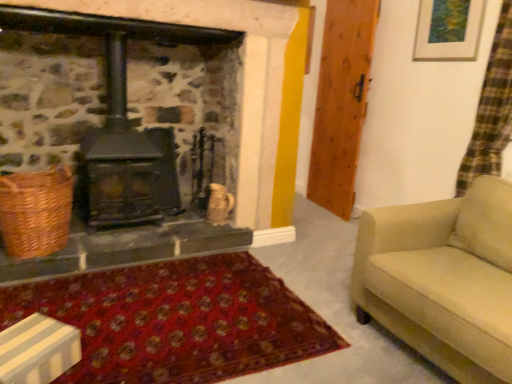
At what (x,y) coordinates should I click in order to perform the action: click on black cast iron wood burning stove at center. Please return your answer as a coordinate pair (x, y). Image resolution: width=512 pixels, height=384 pixels. Looking at the image, I should click on pyautogui.click(x=120, y=157).

The height and width of the screenshot is (384, 512). What do you see at coordinates (443, 279) in the screenshot? I see `beige fabric couch at right` at bounding box center [443, 279].

In the scene shown: Measure the distance between beige fabric couch at right and camera.

beige fabric couch at right and camera are 1.38 meters apart.

Find the location of a particular element. The width and height of the screenshot is (512, 384). wooden picture frame at upper right is located at coordinates (448, 30).

Who is taller, beige fabric couch at right or wooden door at right?

With more height is wooden door at right.

Considering the sizes of beige fabric couch at right and wooden door at right in the image, is beige fabric couch at right wider or thinner than wooden door at right?

Considering their sizes, beige fabric couch at right looks broader than wooden door at right.

Identify the location of studio couch below the wooden door at right (from a real-world perspective). This screenshot has height=384, width=512. (443, 279).

Is point (481, 271) positioned behind point (347, 69)?

That is False.

Is wooden picture frame at upper right surrounded by wooden door at right?

Definitely not — wooden picture frame at upper right is not inside wooden door at right.

Which object is closer to the camera taking this photo, wooden door at right or wooden picture frame at upper right?

wooden picture frame at upper right is more forward.

Measure the distance from wooden door at right to wooden picture frame at upper right.

The distance of wooden door at right from wooden picture frame at upper right is 28.32 inches.

Between wooden door at right and wooden picture frame at upper right, which one has smaller width?

wooden picture frame at upper right is thinner.

From the image's perspective, is wooden picture frame at upper right under wooden door at right?

No, from the image's perspective, wooden picture frame at upper right is not beneath wooden door at right.

Is wooden picture frame at upper right surrounding wooden door at right?

Actually, wooden door at right is outside wooden picture frame at upper right.

Considering the relative positions of wooden picture frame at upper right and wooden door at right in the image provided, is wooden picture frame at upper right to the left or to the right of wooden door at right?

wooden picture frame at upper right is to the right of wooden door at right.

Is woven brown basket at left to the right of beige fabric couch at right from the viewer's perspective?

No.

Measure the distance from woven brown basket at left to beige fabric couch at right.

A distance of 5.96 feet exists between woven brown basket at left and beige fabric couch at right.

From a real-world perspective, is woven brown basket at left on beige fabric couch at right?

Indeed, from a real-world perspective, woven brown basket at left stands above beige fabric couch at right.

Does point (50, 242) appear closer or farther from the camera than point (429, 300)?

Point (50, 242) appears to be farther away from the viewer than point (429, 300).

Identify the location of wood that is on the left side of beige fabric couch at right. The width and height of the screenshot is (512, 384). (341, 103).

Is wooden door at right with beige fabric couch at right?

wooden door at right and beige fabric couch at right are not in contact.

Which object is further away from the camera taking this photo, wooden door at right or beige fabric couch at right?

wooden door at right is more distant.

Does point (328, 162) come behind point (415, 235)?

Yes, it is.

Does beige fabric couch at right have a lesser width compared to woven brown basket at left?

No.

Is beige fabric couch at right closer to the viewer compared to woven brown basket at left?

That is True.

Is beige fabric couch at right bigger than woven brown basket at left?

Correct, beige fabric couch at right is larger in size than woven brown basket at left.

How different are the orientations of beige fabric couch at right and woven brown basket at left in degrees?

beige fabric couch at right and woven brown basket at left are facing 83.8 degrees away from each other.

From a real-world perspective, is beige fabric couch at right over black cast iron wood burning stove at center?

Incorrect, from a real-world perspective, beige fabric couch at right is lower than black cast iron wood burning stove at center.

Which is more to the left, beige fabric couch at right or black cast iron wood burning stove at center?

Positioned to the left is black cast iron wood burning stove at center.

Considering the relative sizes of beige fabric couch at right and black cast iron wood burning stove at center in the image provided, is beige fabric couch at right thinner than black cast iron wood burning stove at center?

Incorrect, the width of beige fabric couch at right is not less than that of black cast iron wood burning stove at center.

From their relative heights in the image, would you say beige fabric couch at right is taller or shorter than black cast iron wood burning stove at center?

In the image, beige fabric couch at right appears to be shorter than black cast iron wood burning stove at center.

This screenshot has height=384, width=512. Find the location of `wood lying above the beige fabric couch at right (from the image's perspective)`. wood lying above the beige fabric couch at right (from the image's perspective) is located at coordinates (341, 103).

This screenshot has height=384, width=512. In order to click on wood that is on the left side of wooden picture frame at upper right in this screenshot , I will do (341, 103).

Considering their positions, is beige fabric couch at right positioned closer to wooden picture frame at upper right than black cast iron wood burning stove at center?

Among the two, beige fabric couch at right is located nearer to wooden picture frame at upper right.

Looking at the image, which one is located closer to beige fabric couch at right, black cast iron wood burning stove at center or wooden door at right?

The object closer to beige fabric couch at right is black cast iron wood burning stove at center.

From the image, which object appears to be nearer to beige fabric couch at right, wooden door at right or wooden picture frame at upper right?

wooden picture frame at upper right.

Based on their spatial positions, is beige fabric couch at right or woven brown basket at left further from black cast iron wood burning stove at center?

beige fabric couch at right.

When comparing their distances from beige fabric couch at right, does wooden picture frame at upper right or wooden door at right seem closer?

wooden picture frame at upper right is closer to beige fabric couch at right.

Based on their spatial positions, is wooden picture frame at upper right or beige fabric couch at right closer to wooden door at right?

wooden picture frame at upper right is positioned closer to the anchor wooden door at right.

From the image, which object appears to be farther from wooden picture frame at upper right, black cast iron wood burning stove at center or beige fabric couch at right?

black cast iron wood burning stove at center is further to wooden picture frame at upper right.

Considering their positions, is black cast iron wood burning stove at center positioned further to wooden door at right than beige fabric couch at right?

black cast iron wood burning stove at center is positioned further to the anchor wooden door at right.

What are the coordinates of `wood burning stove between woven brown basket at left and beige fabric couch at right in the horizontal direction` in the screenshot? It's located at (120, 157).

You are a GUI agent. You are given a task and a screenshot of the screen. Output one action in this format:
    pyautogui.click(x=<x>, y=<y>)
    Task: Click on the wood between black cast iron wood burning stove at center and wooden picture frame at upper right
    This screenshot has width=512, height=384.
    Given the screenshot: What is the action you would take?
    pyautogui.click(x=341, y=103)

This screenshot has height=384, width=512. Find the location of `wood burning stove between woven brown basket at left and wooden picture frame at upper right in the horizontal direction`. wood burning stove between woven brown basket at left and wooden picture frame at upper right in the horizontal direction is located at coordinates (120, 157).

Find the location of a particular element. wood between woven brown basket at left and wooden picture frame at upper right is located at coordinates (341, 103).